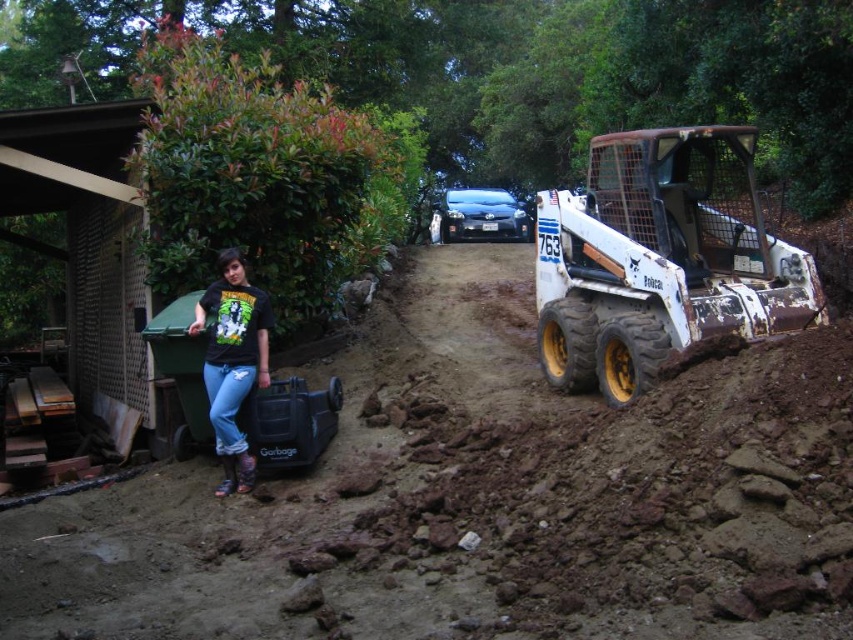
From the picture: You are a construction worker who needs to transport a 1.5 meter wide equipment through the dirt path. The path is bordered by the brown clay dirt at center and the black matte shirt at left. Can the equipment pass through the path without any adjustments?

The brown clay dirt at center is wider than the black matte shirt at left. However, since the exact width of the path isn t provided, we cannot confirm if the 1.5 meter wide equipment can pass through without adjustments. More information is needed.

Based on the coordinates provided, what object is located at point (660,259) in the image?

The point (660,259) indicates the location of the white rusty tractor at right.